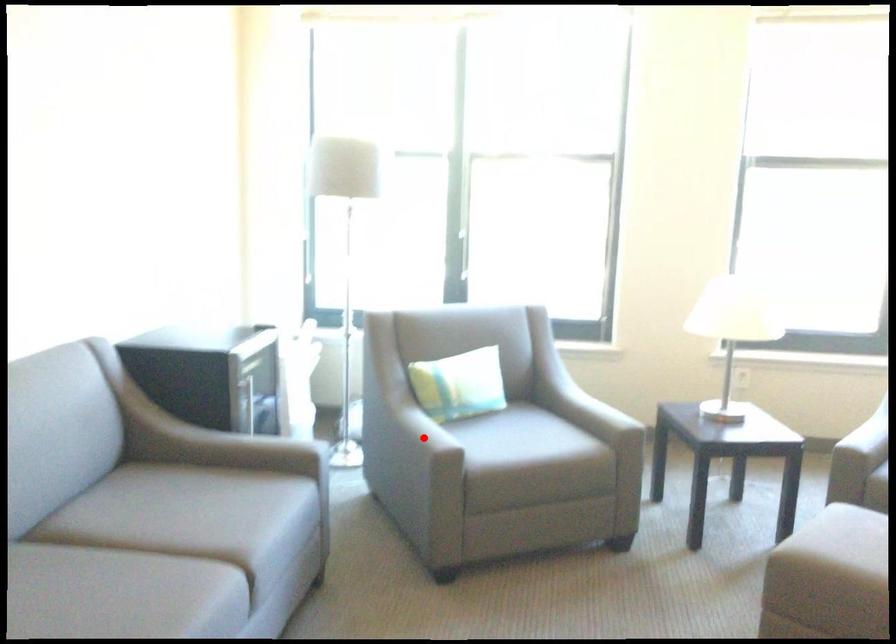
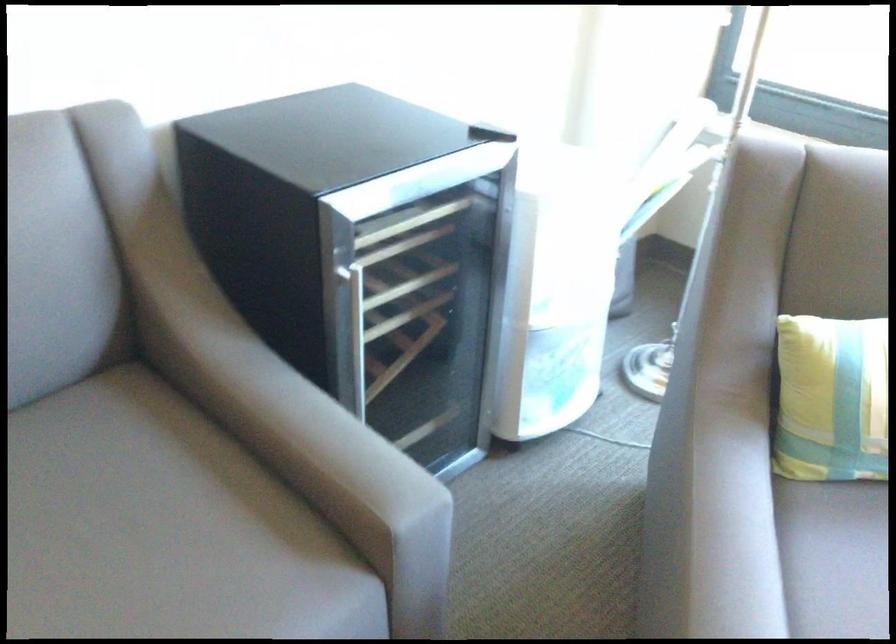
Question: A red point is marked in image1. In image2, is the corresponding 3D point closer to the camera or farther? Reply with the corresponding letter.

Choices:
 (A) The corresponding 3D point is closer.
 (B) The corresponding 3D point is farther.

Answer: (A)